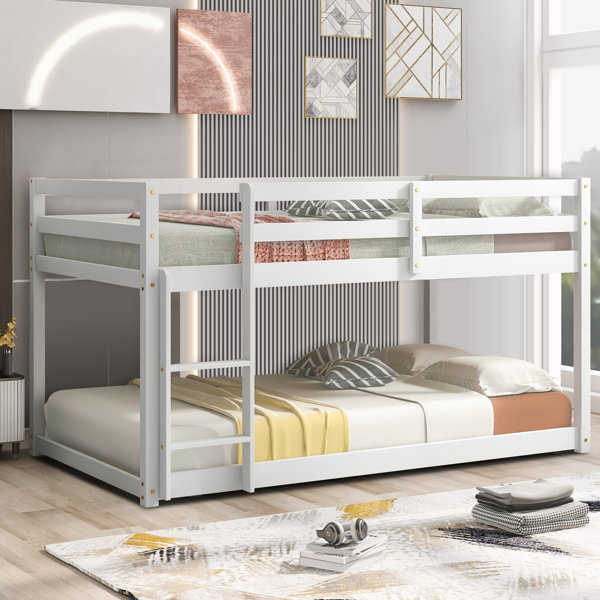
You are a GUI agent. You are given a task and a screenshot of the screen. Output one action in this format:
    pyautogui.click(x=<x>, y=<y>)
    Task: Click on the blankets
    Image resolution: width=600 pixels, height=600 pixels.
    Given the screenshot: What is the action you would take?
    pyautogui.click(x=273, y=419), pyautogui.click(x=293, y=249)